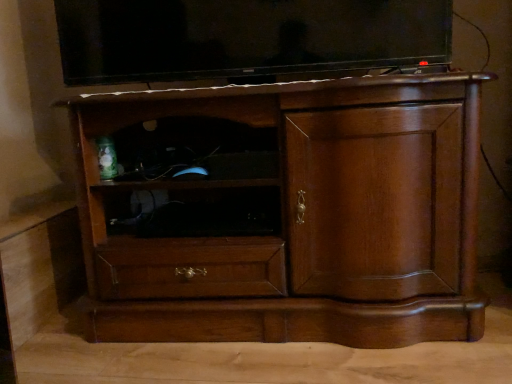
Question: Is black matte shelf at center looking in the opposite direction of matte black tv at upper center?

Choices:
 (A) yes
 (B) no

Answer: (B)

Question: Does black matte shelf at center appear on the right side of matte black tv at upper center?

Choices:
 (A) yes
 (B) no

Answer: (B)

Question: Considering the relative sizes of black matte shelf at center and matte black tv at upper center in the image provided, is black matte shelf at center bigger than matte black tv at upper center?

Choices:
 (A) yes
 (B) no

Answer: (B)

Question: Is black matte shelf at center not close to matte black tv at upper center?

Choices:
 (A) no
 (B) yes

Answer: (A)

Question: Considering the relative sizes of black matte shelf at center and matte black tv at upper center in the image provided, is black matte shelf at center thinner than matte black tv at upper center?

Choices:
 (A) yes
 (B) no

Answer: (B)

Question: Does black matte shelf at center have a lesser height compared to matte black tv at upper center?

Choices:
 (A) no
 (B) yes

Answer: (B)

Question: Is the position of matte black tv at upper center less distant than that of brown wood cabinet at center?

Choices:
 (A) yes
 (B) no

Answer: (B)

Question: Is matte black tv at upper center oriented away from brown wood cabinet at center?

Choices:
 (A) yes
 (B) no

Answer: (B)

Question: Does matte black tv at upper center appear on the right side of brown wood cabinet at center?

Choices:
 (A) yes
 (B) no

Answer: (B)

Question: Is the depth of matte black tv at upper center greater than that of brown wood cabinet at center?

Choices:
 (A) yes
 (B) no

Answer: (A)

Question: Considering the relative sizes of matte black tv at upper center and brown wood cabinet at center in the image provided, is matte black tv at upper center thinner than brown wood cabinet at center?

Choices:
 (A) no
 (B) yes

Answer: (B)

Question: Can you confirm if matte black tv at upper center is bigger than brown wood cabinet at center?

Choices:
 (A) yes
 (B) no

Answer: (B)

Question: Does brown wood cabinet at center have a greater height compared to matte black tv at upper center?

Choices:
 (A) yes
 (B) no

Answer: (A)